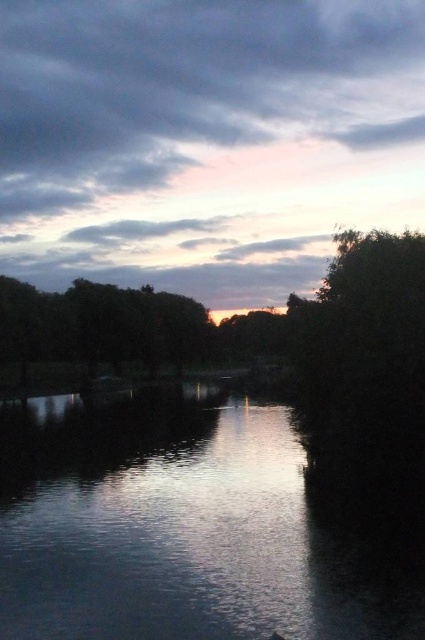
Does pastel sky at center have a larger size compared to green leafy tree at center?

Correct, pastel sky at center is larger in size than green leafy tree at center.

Does pastel sky at center have a lesser width compared to green leafy tree at center?

No.

Locate an element on the screen. pastel sky at center is located at coordinates pos(206,140).

Identify the location of pastel sky at center. pos(206,140).

Does smooth water at center have a greater height compared to green leafy tree at center?

No.

Who is positioned more to the left, smooth water at center or green leafy tree at center?

From the viewer's perspective, green leafy tree at center appears more on the left side.

Which is in front, point (87, 426) or point (104, 310)?

Positioned in front is point (87, 426).

Locate an element on the screen. This screenshot has width=425, height=640. smooth water at center is located at coordinates (186, 528).

Between pastel sky at center and smooth water at center, which one is positioned lower?

smooth water at center is lower down.

Who is shorter, pastel sky at center or smooth water at center?

smooth water at center

Is point (181, 3) positioned before point (237, 416)?

No, (181, 3) is behind (237, 416).

Identify the location of pastel sky at center. This screenshot has width=425, height=640. (206, 140).